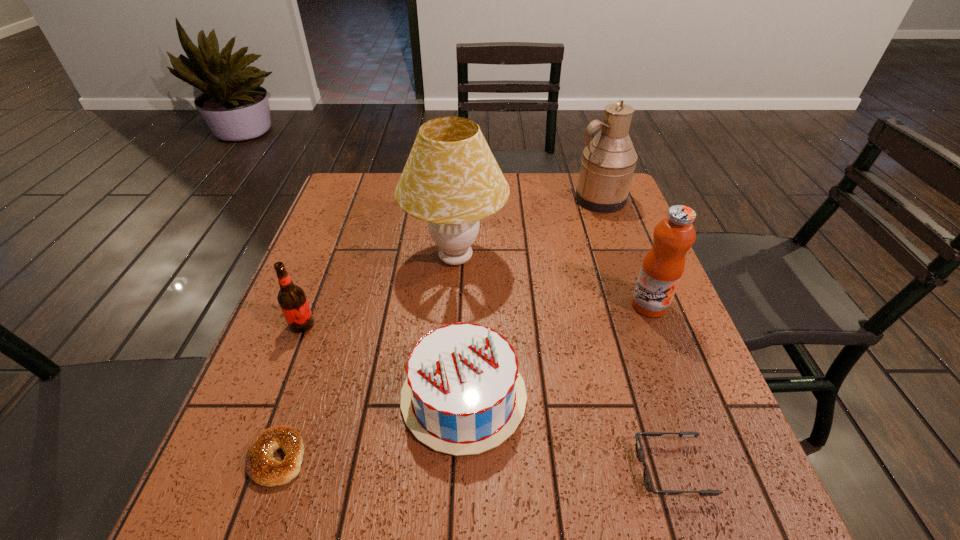
Where is `vacant position located 0.190m on the back of the root beer`? This screenshot has width=960, height=540. vacant position located 0.190m on the back of the root beer is located at coordinates (326, 261).

Locate an element on the screen. vacant space located 0.320m on the right of the birthday cake is located at coordinates (690, 396).

At what (x,y) coordinates should I click in order to perform the action: click on vacant space situated on the temples of the sunglasses. Please return your answer as a coordinate pair (x, y). Looking at the image, I should click on point(540,469).

Find the location of a particular element. The width and height of the screenshot is (960, 540). vacant space situated on the temples of the sunglasses is located at coordinates (417, 469).

In order to click on vacant space situated 0.260m on the temples of the sunglasses in this screenshot , I will do `click(487, 469)`.

Identify the location of vacant space located 0.060m on the right of the bagel. (340, 458).

The width and height of the screenshot is (960, 540). Identify the location of object that is at the far edge. (607, 166).

Image resolution: width=960 pixels, height=540 pixels. In order to click on sunglasses that is at the near edge in this screenshot , I will do `click(648, 481)`.

I want to click on bagel at the near edge, so click(261, 466).

Identify the location of root beer at the left edge. click(292, 300).